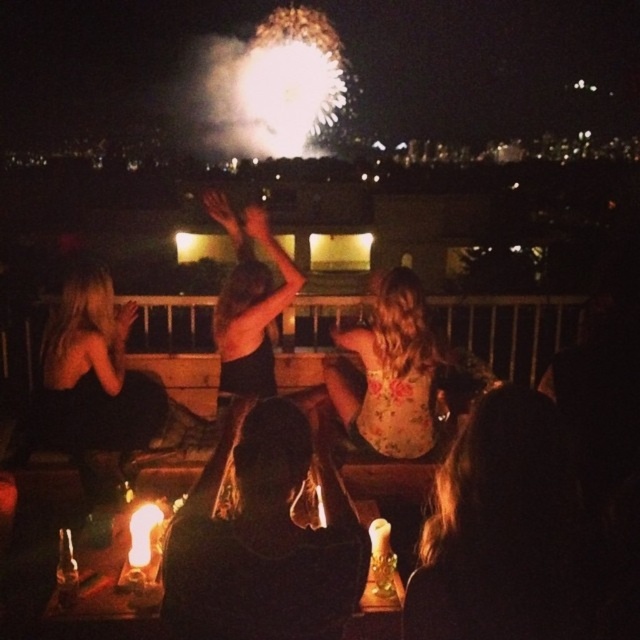
Can you confirm if black matte dress at center is positioned below translucent glass candle at center?

Actually, black matte dress at center is above translucent glass candle at center.

Is black matte dress at center shorter than translucent glass candle at center?

No, black matte dress at center is not shorter than translucent glass candle at center.

Between point (266, 292) and point (122, 620), which one is positioned behind?

The point (266, 292) is behind.

Find the location of a particular element. black matte dress at center is located at coordinates (248, 304).

Does floral-patterned fabric at center come behind black matte dress at center?

No.

Can you confirm if floral-patterned fabric at center is bigger than black matte dress at center?

No.

Locate an element on the screen. This screenshot has height=640, width=640. floral-patterned fabric at center is located at coordinates (388, 371).

Does floral-patterned fabric at center have a greater height compared to translucent glass candle at center?

Indeed, floral-patterned fabric at center has a greater height compared to translucent glass candle at center.

Can you confirm if floral-patterned fabric at center is shorter than translucent glass candle at center?

In fact, floral-patterned fabric at center may be taller than translucent glass candle at center.

You are a GUI agent. You are given a task and a screenshot of the screen. Output one action in this format:
    pyautogui.click(x=<x>, y=<y>)
    Task: Click on the floral-patterned fabric at center
    Image resolution: width=640 pixels, height=640 pixels.
    Given the screenshot: What is the action you would take?
    pyautogui.click(x=388, y=371)

The height and width of the screenshot is (640, 640). Find the location of `floral-patterned fabric at center`. floral-patterned fabric at center is located at coordinates (388, 371).